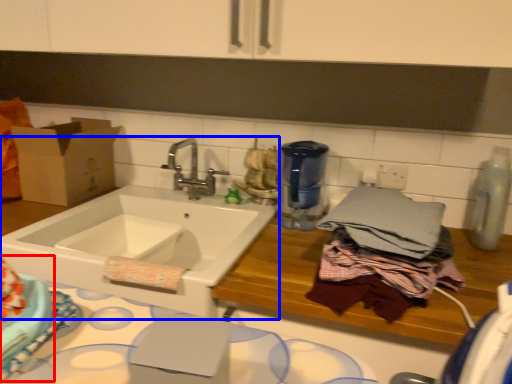
Question: Among these objects, which one is farthest to the camera, cake (highlighted by a red box) or sink (highlighted by a blue box)?

Choices:
 (A) cake
 (B) sink

Answer: (B)